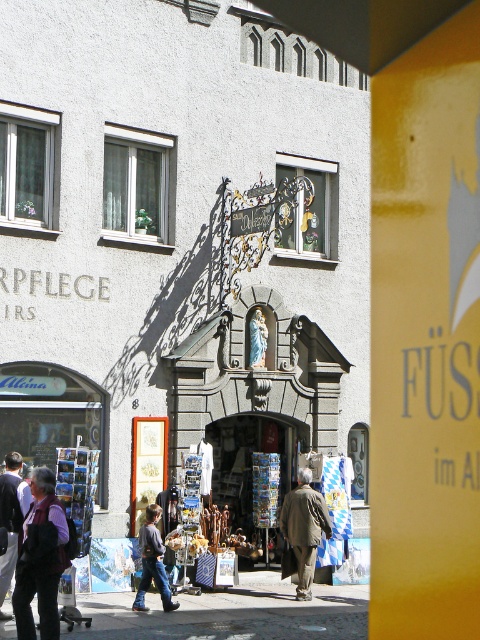
You are standing at the point marked as point (180, 243) in the image. What object is directly beneath you?

The matte gray building at center is located at point (180, 243), so the object directly beneath you is the matte gray building at center.

You are a street vendor who has just arrived at the scene. You need to place your new product display stand between the brown leather jacket at center and the dark brown leather jacket at lower left. Which side of the display stand should face the building with the wrought iron gate and statue?

The display stand should face the building with the wrought iron gate and statue because the brown leather jacket at center is to the right of the dark brown leather jacket at lower left, meaning the space between them is towards the building.

You are a delivery person trying to park your motorcycle between the matte gray building at center and the brown leather jacket at center. Can you fit your motorcycle there if it requires 1.2 meters of space?

The matte gray building at center has a lesser width compared to brown leather jacket at center. However, the description does not provide specific measurements of the space between them, so it is impossible to determine if the motorcycle can fit.